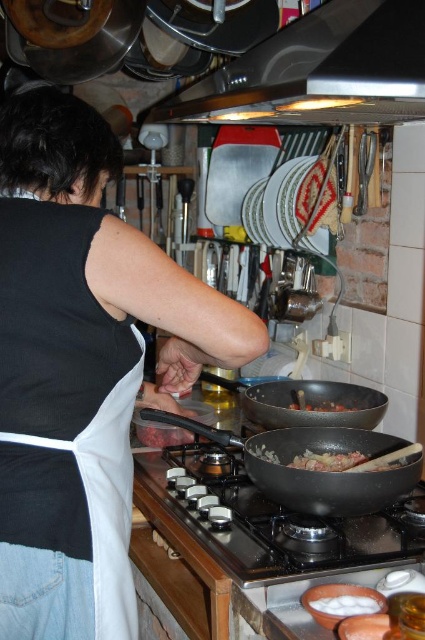
You are a chef preparing a dish and need to check if the shiny black wok at center can hold the white fluffy food at lower center without spilling. Based on their sizes, what should you consider?

The shiny black wok at center is much taller than the white fluffy food at lower center, so there is enough vertical space to hold the food without spilling.

You are standing in the kitchen and want to reach the point at coordinates (333,420), which is where the handle of the wok is located. If your arm can extend 4 feet, can you reach it?

The point at coordinates (333,420) is 4.86 feet away from the viewer. Since your arm can only extend 4 feet, you cannot reach it.

You are a drone delivering a spice jar to the shiny black wok at center in the kitchen. The drone can only hover at a minimum distance of 1.5 meters. Can the drone safely hover above the wok to drop the spice jar?

The shiny black wok at center is 1.46 meters away from the camera, which is less than the drone minimum hovering distance of 1.5 meters. Therefore, the drone cannot safely hover above the wok to drop the spice jar.